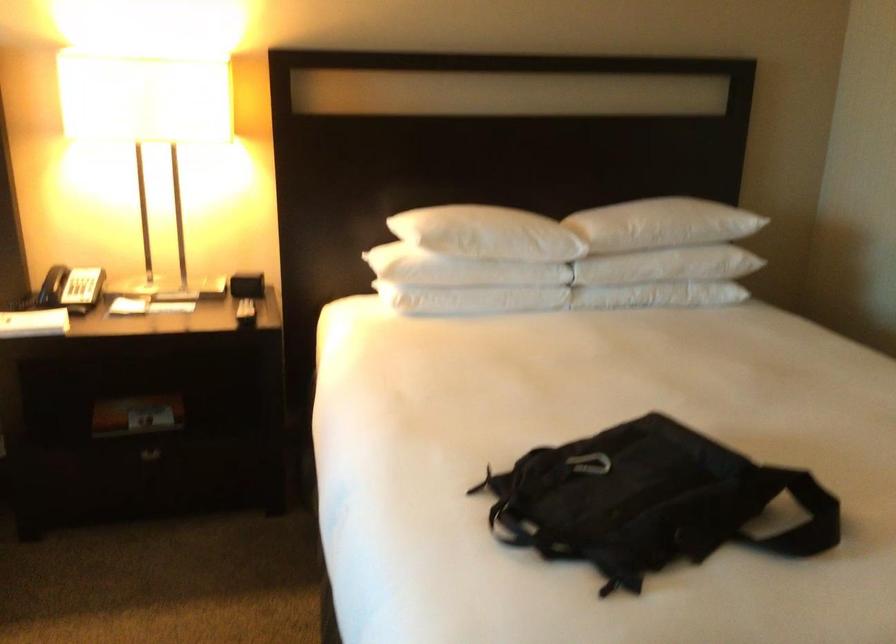
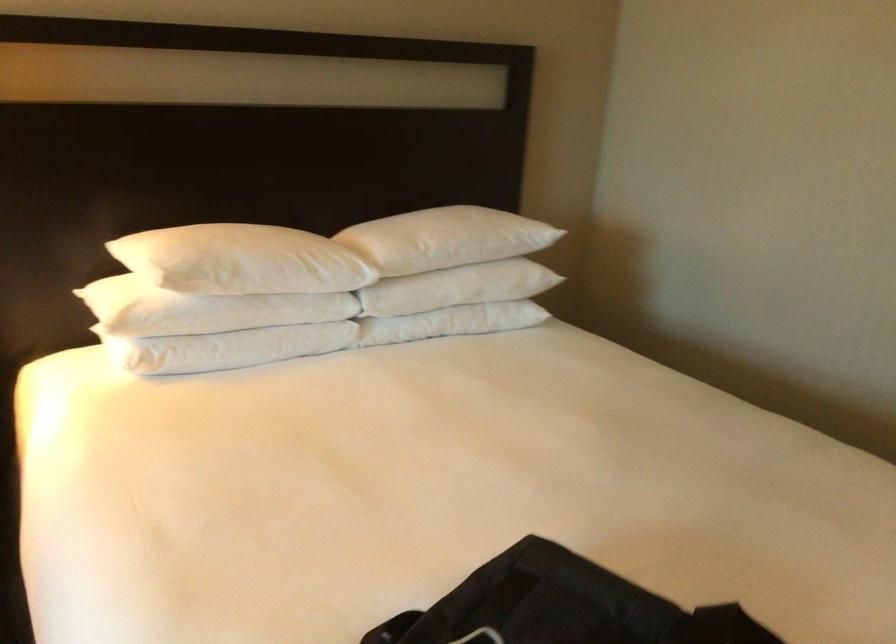
The point at [593,462] is marked in the first image. Where is the corresponding point in the second image?

(480, 637)